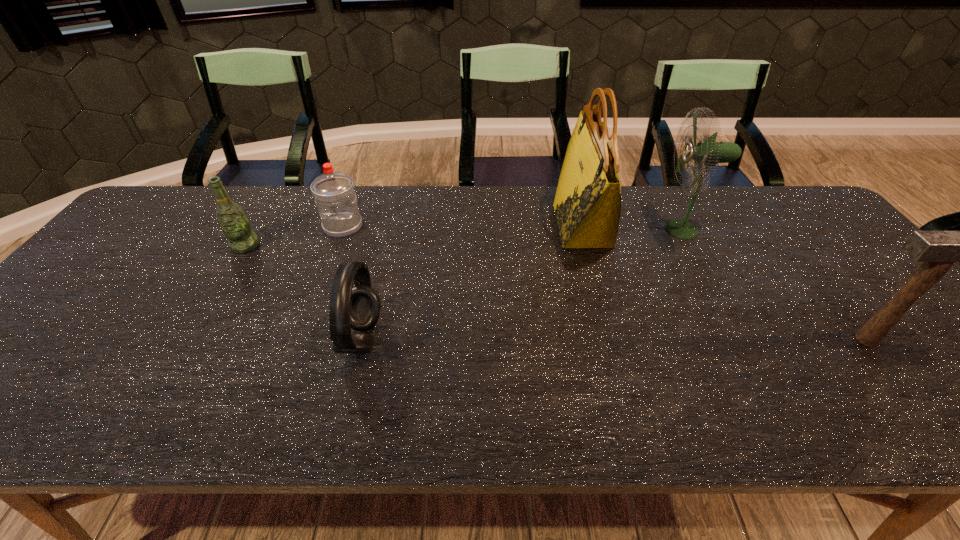
The height and width of the screenshot is (540, 960). Find the location of `object situated at the right edge`. object situated at the right edge is located at coordinates (937, 250).

Identify the location of vacant space at the far edge of the desktop. Image resolution: width=960 pixels, height=540 pixels. 721,199.

Where is `vacant space at the near edge of the desktop`? This screenshot has width=960, height=540. vacant space at the near edge of the desktop is located at coordinates pyautogui.click(x=759, y=432).

Locate an element on the screen. The height and width of the screenshot is (540, 960). free space at the left edge of the desktop is located at coordinates (93, 341).

At what (x,y) coordinates should I click in order to perform the action: click on vacant position at the right edge of the desktop. Please return your answer as a coordinate pair (x, y). This screenshot has height=540, width=960. Looking at the image, I should click on (916, 373).

Find the location of a particular element. This screenshot has height=540, width=960. vacant area at the far left corner of the desktop is located at coordinates (172, 197).

In the image, there is a desktop. At what (x,y) coordinates should I click in order to perform the action: click on vacant space at the far right corner. Please return your answer as a coordinate pair (x, y). This screenshot has height=540, width=960. Looking at the image, I should click on (797, 197).

This screenshot has width=960, height=540. Find the location of `vacant space that's between the mallet and the third object from left to right`. vacant space that's between the mallet and the third object from left to right is located at coordinates tap(614, 339).

In order to click on free space between the fan and the tote bag in this screenshot , I will do `click(633, 227)`.

At what (x,y) coordinates should I click in order to perform the action: click on vacant space that is in between the rightmost object and the headset. Please return your answer as a coordinate pair (x, y). The width and height of the screenshot is (960, 540). Looking at the image, I should click on (614, 339).